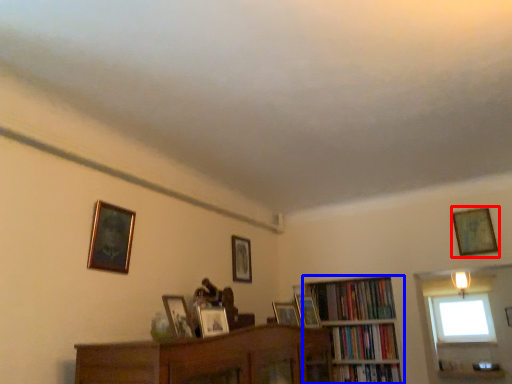
Question: Which object is further to the camera taking this photo, picture frame (highlighted by a red box) or bookcase (highlighted by a blue box)?

Choices:
 (A) picture frame
 (B) bookcase

Answer: (B)